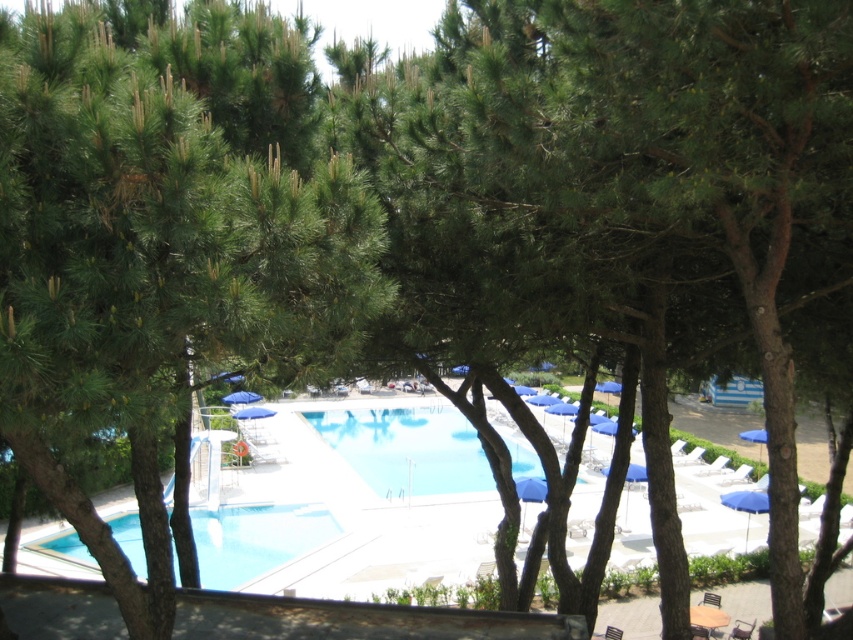
Does blue smooth water at center have a greater width compared to blue fabric umbrella at lower right?

Indeed, blue smooth water at center has a greater width compared to blue fabric umbrella at lower right.

Does point (131, 548) come farther from viewer compared to point (759, 500)?

That is True.

This screenshot has height=640, width=853. In order to click on blue smooth water at center in this screenshot , I will do `click(256, 540)`.

Describe the element at coordinates (407, 448) in the screenshot. I see `clear blue water at center` at that location.

Can you confirm if clear blue water at center is smaller than blue fabric umbrella at center?

Incorrect, clear blue water at center is not smaller in size than blue fabric umbrella at center.

What are the coordinates of `clear blue water at center` in the screenshot? It's located at (407, 448).

Image resolution: width=853 pixels, height=640 pixels. I want to click on clear blue water at center, so click(407, 448).

Measure the distance from green needle-like leaves at center to clear blue water at center.

green needle-like leaves at center and clear blue water at center are 84.22 feet apart.

Is green needle-like leaves at center closer to camera compared to clear blue water at center?

That is True.

Identify the location of green needle-like leaves at center. The height and width of the screenshot is (640, 853). (161, 243).